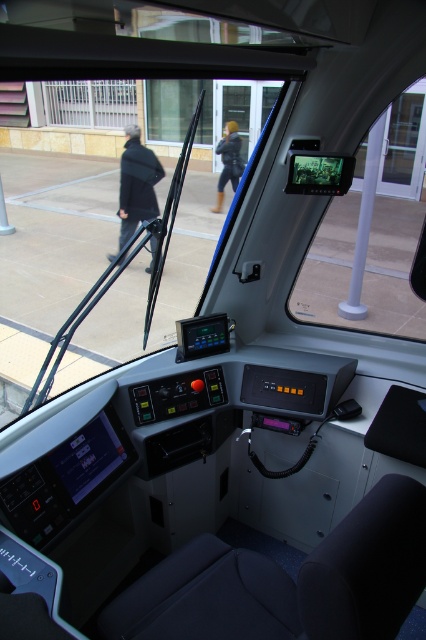
Question: Which object is farther from the camera taking this photo?

Choices:
 (A) metallic bars at upper left
 (B) black matte coat at left
 (C) leather boots at center

Answer: (A)

Question: Can you confirm if transparent glass monitor at upper center is wider than metallic bars at upper left?

Choices:
 (A) yes
 (B) no

Answer: (B)

Question: Is black matte coat at left above leather boots at center?

Choices:
 (A) no
 (B) yes

Answer: (A)

Question: Is metallic bars at upper left to the left of black matte coat at left from the viewer's perspective?

Choices:
 (A) yes
 (B) no

Answer: (A)

Question: Which point is farther from the camera taking this photo?

Choices:
 (A) (391, 113)
 (B) (97, 88)
 (C) (132, 182)
 (D) (229, 140)

Answer: (B)

Question: Among these points, which one is nearest to the camera?

Choices:
 (A) (103, 113)
 (B) (227, 147)

Answer: (B)